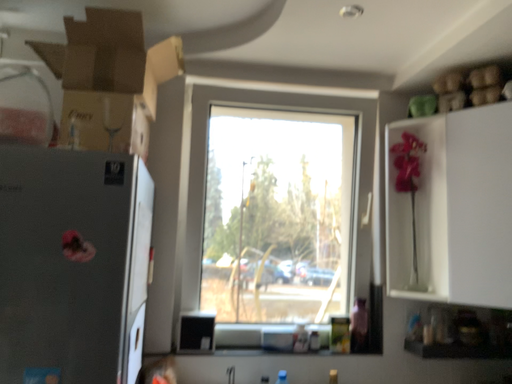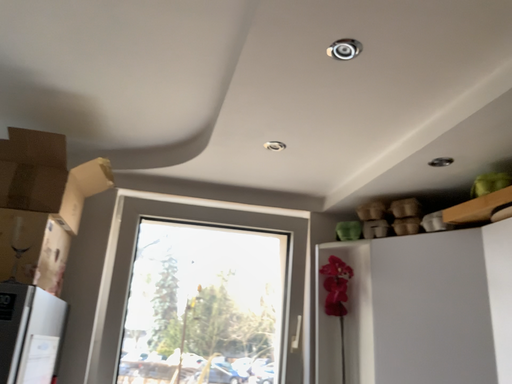
Question: Which way did the camera rotate in the video?

Choices:
 (A) rotated downward
 (B) rotated upward

Answer: (B)